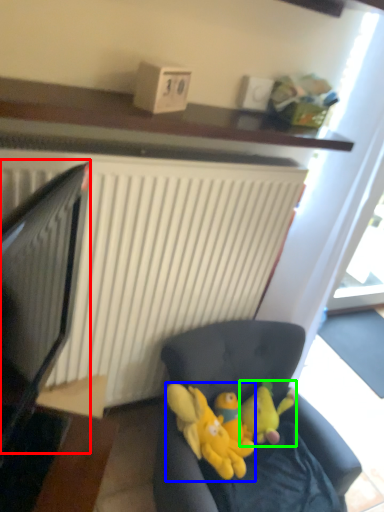
Question: Which object is positioned farthest from computer monitor (highlighted by a red box)? Select from toy (highlighted by a blue box) and toy (highlighted by a green box).

Choices:
 (A) toy
 (B) toy

Answer: (B)